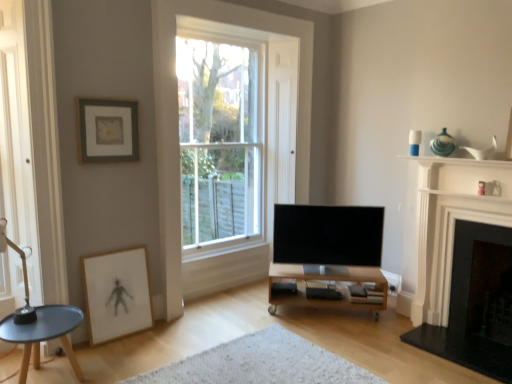
Question: Considering the relative sizes of white marble fireplace at right, which is the second fireplace from right to left, and flat screen tv at center in the image provided, is white marble fireplace at right, which is the second fireplace from right to left, taller than flat screen tv at center?

Choices:
 (A) yes
 (B) no

Answer: (A)

Question: Considering the relative positions of white marble fireplace at right, which is the second fireplace from right to left, and flat screen tv at center in the image provided, is white marble fireplace at right, which is the second fireplace from right to left, to the left of flat screen tv at center from the viewer's perspective?

Choices:
 (A) no
 (B) yes

Answer: (A)

Question: Is white marble fireplace at right, which is the second fireplace from right to left, smaller than flat screen tv at center?

Choices:
 (A) yes
 (B) no

Answer: (B)

Question: Is white marble fireplace at right, which is the 1th fireplace from left to right, next to flat screen tv at center?

Choices:
 (A) yes
 (B) no

Answer: (B)

Question: Does white marble fireplace at right, which is the second fireplace from right to left, have a larger size compared to flat screen tv at center?

Choices:
 (A) no
 (B) yes

Answer: (B)

Question: Is matte gray picture frame at upper left, placed as the first picture frame when sorted from top to bottom, situated inside white textured rug at center or outside?

Choices:
 (A) outside
 (B) inside

Answer: (A)

Question: Considering their positions, is matte gray picture frame at upper left, placed as the first picture frame when sorted from top to bottom, located in front of or behind white textured rug at center?

Choices:
 (A) behind
 (B) front

Answer: (A)

Question: Does point pos(133,120) appear closer or farther from the camera than point pos(286,331)?

Choices:
 (A) closer
 (B) farther

Answer: (A)

Question: Would you say matte gray picture frame at upper left, placed as the first picture frame when sorted from top to bottom, is to the left or to the right of white textured rug at center in the picture?

Choices:
 (A) left
 (B) right

Answer: (A)

Question: From the image's perspective, is white textured rug at center above or below matte black coffee table at lower left?

Choices:
 (A) below
 (B) above

Answer: (A)

Question: Is white textured rug at center inside or outside of matte black coffee table at lower left?

Choices:
 (A) inside
 (B) outside

Answer: (B)

Question: From a real-world perspective, is white textured rug at center positioned above or below matte black coffee table at lower left?

Choices:
 (A) below
 (B) above

Answer: (A)

Question: Is white textured rug at center in front of or behind matte black coffee table at lower left in the image?

Choices:
 (A) front
 (B) behind

Answer: (A)

Question: In terms of height, does clear glass window at center look taller or shorter compared to flat screen tv at center?

Choices:
 (A) tall
 (B) short

Answer: (A)

Question: Is point (204, 195) closer or farther from the camera than point (336, 210)?

Choices:
 (A) closer
 (B) farther

Answer: (B)